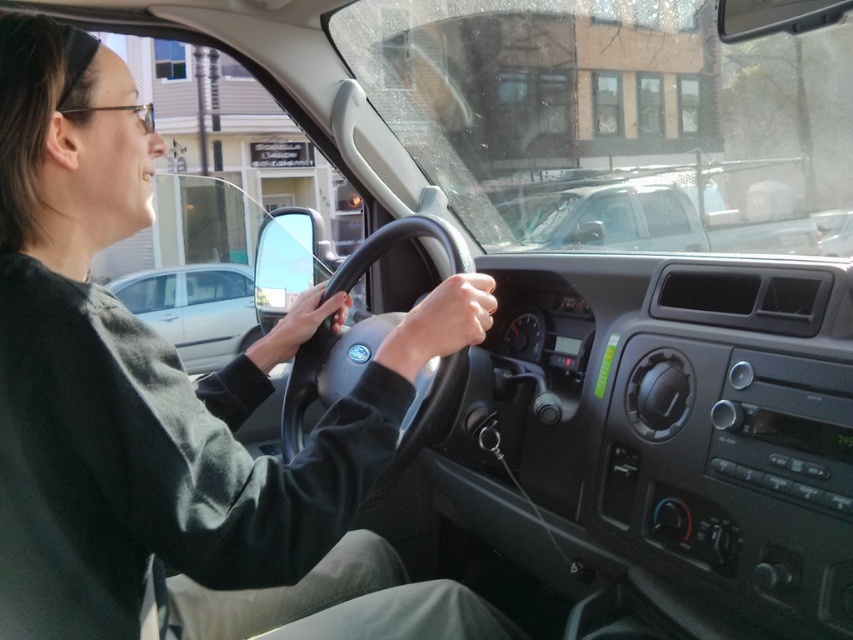
Question: Which point appears farthest from the camera in this image?

Choices:
 (A) 178,320
 (B) 332,435
 (C) 534,81

Answer: (C)

Question: Is dark green sweater at center positioned in front of silver metallic sedan at center?

Choices:
 (A) yes
 (B) no

Answer: (A)

Question: Which of the following is the farthest from the observer?

Choices:
 (A) (372, 342)
 (B) (221, 289)
 (C) (776, 124)

Answer: (C)

Question: Can you confirm if dark green sweater at center is positioned to the right of black rubber steering wheel at center?

Choices:
 (A) yes
 (B) no

Answer: (B)

Question: Which object appears farthest from the camera in this image?

Choices:
 (A) silver metallic sedan at center
 (B) dark green sweater at center
 (C) black rubber steering wheel at center
 (D) transparent glass windshield at upper center

Answer: (D)

Question: Where is dark green sweater at center located in relation to black rubber steering wheel at center in the image?

Choices:
 (A) right
 (B) left

Answer: (B)